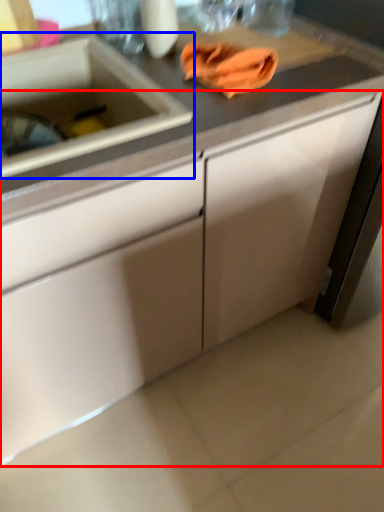
Question: Which point is further to the camera, cabinetry (highlighted by a red box) or sink (highlighted by a blue box)?

Choices:
 (A) cabinetry
 (B) sink

Answer: (B)